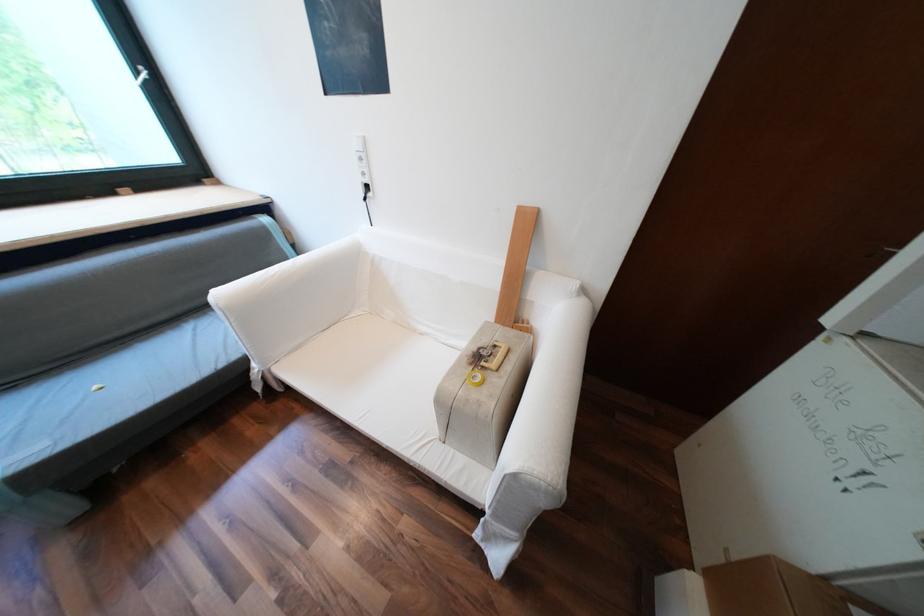
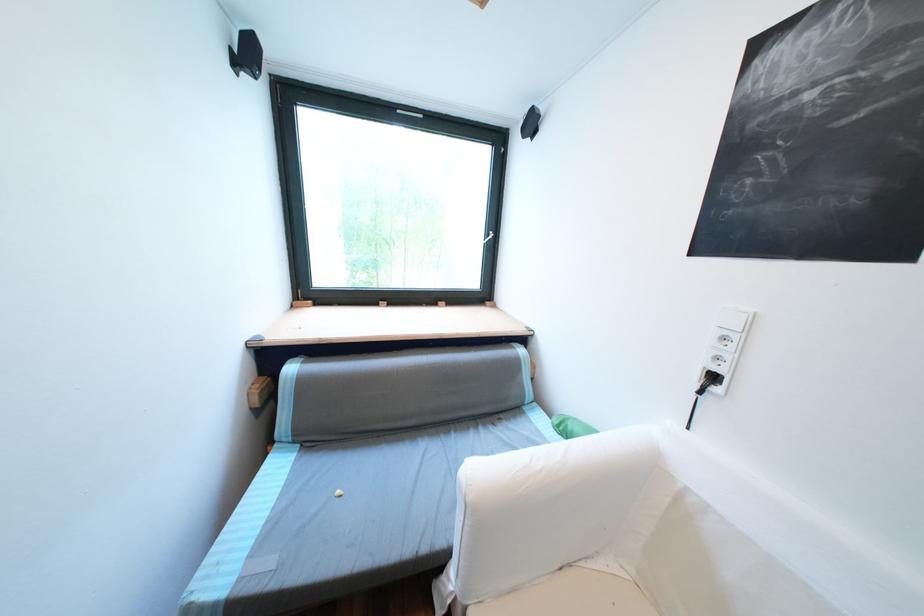
Question: The images are taken continuously from a first-person perspective. In which direction is your viewpoint rotating?

Choices:
 (A) Left
 (B) Right
 (C) Up
 (D) Down

Answer: (A)